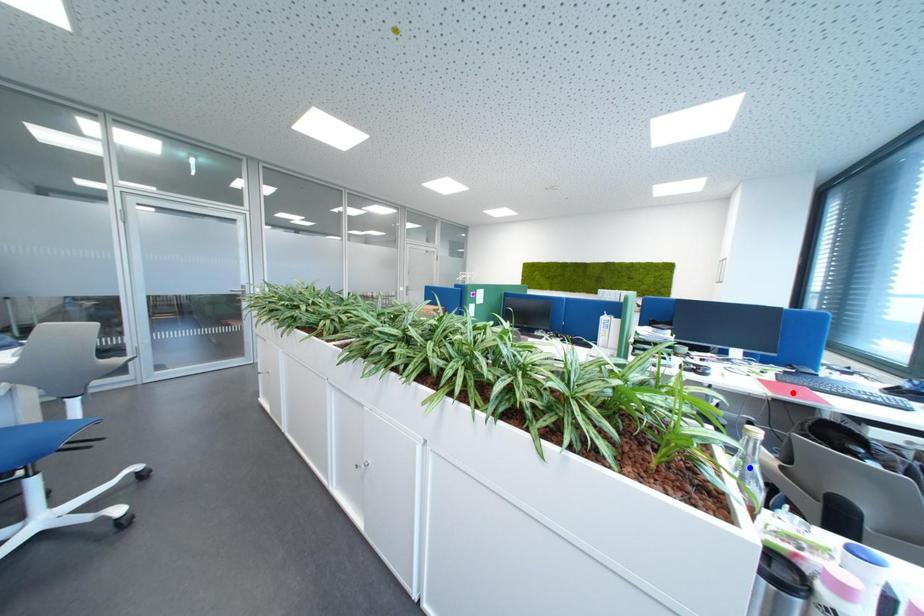
Question: Two points are marked on the image. Which point is closer to the camera?

Choices:
 (A) Blue point is closer.
 (B) Red point is closer.

Answer: (A)